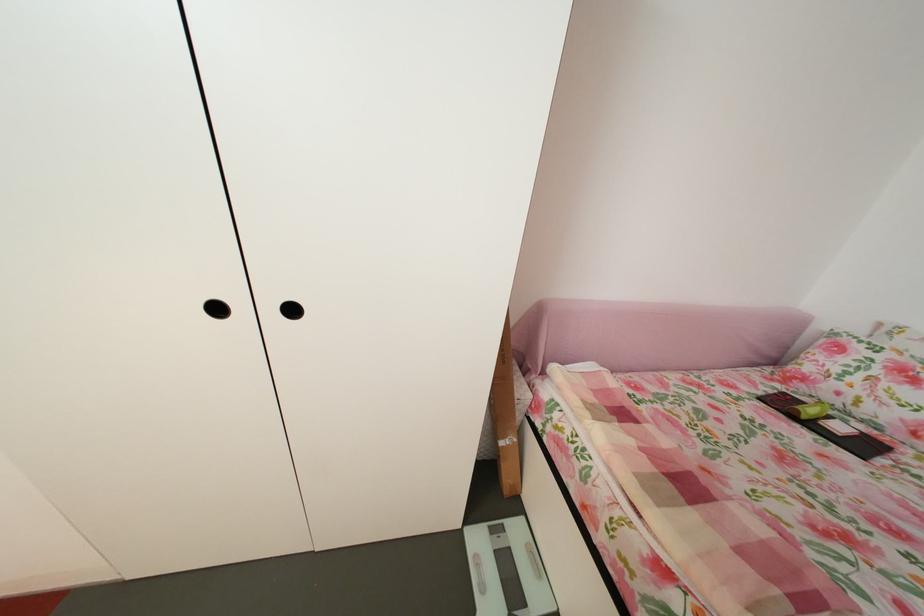
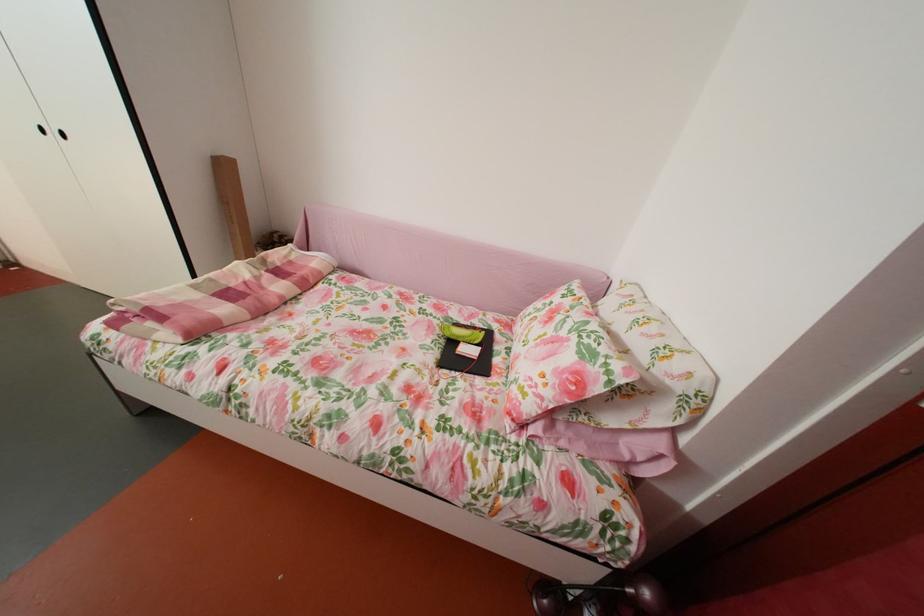
Where in the second image is the point corresponding to the point at 772,400 from the first image?

(473, 328)